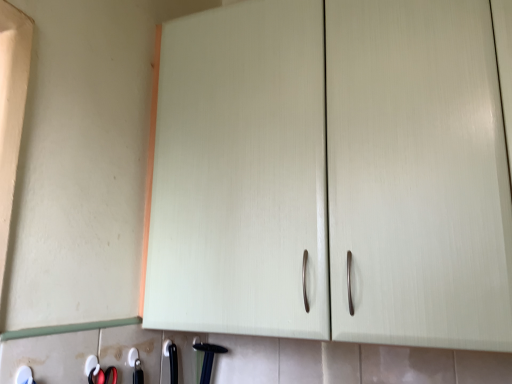
This screenshot has height=384, width=512. I want to click on white plastic tool at lower left, so click(x=24, y=375).

What is the approximate height of white plastic tool at lower left?

white plastic tool at lower left is 3.82 centimeters tall.

The width and height of the screenshot is (512, 384). Describe the element at coordinates (24, 375) in the screenshot. I see `white plastic tool at lower left` at that location.

What is the approximate height of black plastic hammer at lower center?

black plastic hammer at lower center is 11.11 inches in height.

The height and width of the screenshot is (384, 512). What are the coordinates of `black plastic hammer at lower center` in the screenshot? It's located at (208, 359).

The height and width of the screenshot is (384, 512). What do you see at coordinates (208, 359) in the screenshot?
I see `black plastic hammer at lower center` at bounding box center [208, 359].

The height and width of the screenshot is (384, 512). In order to click on white plastic tool at lower left in this screenshot , I will do coord(24,375).

Is white plastic tool at lower left to the right of black plastic hammer at lower center from the viewer's perspective?

Incorrect, white plastic tool at lower left is not on the right side of black plastic hammer at lower center.

Does white plastic tool at lower left come behind black plastic hammer at lower center?

That is False.

Does point (21, 366) come behind point (199, 348)?

No, it is not.

From the image's perspective, is white plastic tool at lower left over black plastic hammer at lower center?

Yes, from the image's perspective, white plastic tool at lower left is over black plastic hammer at lower center.

From a real-world perspective, is white plastic tool at lower left above or below black plastic hammer at lower center?

In terms of real-world spatial position, white plastic tool at lower left is above black plastic hammer at lower center.

Considering the relative sizes of white plastic tool at lower left and black plastic hammer at lower center in the image provided, is white plastic tool at lower left wider than black plastic hammer at lower center?

In fact, white plastic tool at lower left might be narrower than black plastic hammer at lower center.

Can you confirm if white plastic tool at lower left is taller than black plastic hammer at lower center?

No.

Consider the image. Considering the sizes of objects white plastic tool at lower left and black plastic hammer at lower center in the image provided, who is bigger, white plastic tool at lower left or black plastic hammer at lower center?

With larger size is black plastic hammer at lower center.

Could black plastic hammer at lower center be considered to be inside white plastic tool at lower left?

No, white plastic tool at lower left does not contain black plastic hammer at lower center.

Would you say white plastic tool at lower left is a long distance from black plastic hammer at lower center?

No, there isn't a large distance between white plastic tool at lower left and black plastic hammer at lower center.

Is white plastic tool at lower left aimed at black plastic hammer at lower center?

No, white plastic tool at lower left is not aimed at black plastic hammer at lower center.

Image resolution: width=512 pixels, height=384 pixels. I want to click on tool that is above the black plastic hammer at lower center (from the image's perspective), so click(x=24, y=375).

Does black plastic hammer at lower center appear on the left side of white plastic tool at lower left?

No, black plastic hammer at lower center is not to the left of white plastic tool at lower left.

Who is more distant, black plastic hammer at lower center or white plastic tool at lower left?

black plastic hammer at lower center.

Does point (208, 357) lie behind point (30, 379)?

Yes, it is.

From the image's perspective, is black plastic hammer at lower center above white plastic tool at lower left?

No, from the image's perspective, black plastic hammer at lower center is not on top of white plastic tool at lower left.

From a real-world perspective, is black plastic hammer at lower center physically located above or below white plastic tool at lower left?

black plastic hammer at lower center is situated lower than white plastic tool at lower left in the real world.

Between black plastic hammer at lower center and white plastic tool at lower left, which one has smaller width?

white plastic tool at lower left.

From their relative heights in the image, would you say black plastic hammer at lower center is taller or shorter than white plastic tool at lower left?

Considering their sizes, black plastic hammer at lower center has more height than white plastic tool at lower left.

Does black plastic hammer at lower center have a smaller size compared to white plastic tool at lower left?

No, black plastic hammer at lower center is not smaller than white plastic tool at lower left.

Can we say black plastic hammer at lower center lies outside white plastic tool at lower left?

Yes, black plastic hammer at lower center is not within white plastic tool at lower left.

Is black plastic hammer at lower center not near white plastic tool at lower left?

No, there isn't a large distance between black plastic hammer at lower center and white plastic tool at lower left.

Is black plastic hammer at lower center oriented away from white plastic tool at lower left?

No, white plastic tool at lower left is not at the back of black plastic hammer at lower center.

From the picture: What's the angular difference between black plastic hammer at lower center and white plastic tool at lower left's facing directions?

The angular difference between black plastic hammer at lower center and white plastic tool at lower left is 1.37 degrees.

The height and width of the screenshot is (384, 512). In order to click on tool on the left side of black plastic hammer at lower center in this screenshot , I will do `click(24, 375)`.

The image size is (512, 384). In order to click on tool above the black plastic hammer at lower center (from the image's perspective) in this screenshot , I will do `click(24, 375)`.

Locate an element on the screen. The height and width of the screenshot is (384, 512). door handle on the right of white plastic tool at lower left is located at coordinates (208, 359).